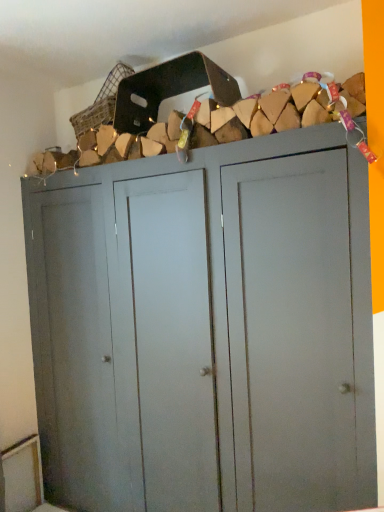
Question: Based on their sizes in the image, would you say matte gray cupboard at center is bigger or smaller than woven wicker basket at upper center?

Choices:
 (A) big
 (B) small

Answer: (A)

Question: In the image, is matte gray cupboard at center positioned in front of or behind woven wicker basket at upper center?

Choices:
 (A) front
 (B) behind

Answer: (A)

Question: From a real-world perspective, relative to woven wicker basket at upper center, is matte gray cupboard at center vertically above or below?

Choices:
 (A) above
 (B) below

Answer: (B)

Question: From a real-world perspective, is woven wicker basket at upper center physically located above or below matte gray cupboard at center?

Choices:
 (A) above
 (B) below

Answer: (A)

Question: Is woven wicker basket at upper center spatially inside matte gray cupboard at center, or outside of it?

Choices:
 (A) outside
 (B) inside

Answer: (A)

Question: In the image, is woven wicker basket at upper center positioned in front of or behind matte gray cupboard at center?

Choices:
 (A) behind
 (B) front

Answer: (A)

Question: Is woven wicker basket at upper center to the left or to the right of matte gray cupboard at center in the image?

Choices:
 (A) left
 (B) right

Answer: (A)